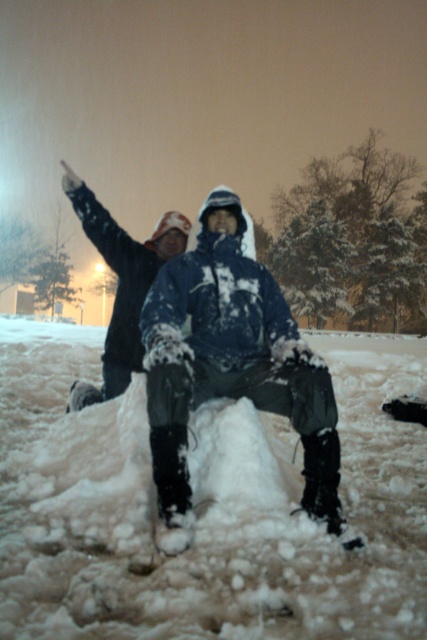
Question: Which of these objects is positioned closest to the dark blue jacket at center?

Choices:
 (A) snow-covered jacket at center
 (B) white fluffy snow at center

Answer: (A)

Question: Among these objects, which one is farthest from the camera?

Choices:
 (A) white fluffy snow at center
 (B) snow-covered jacket at center
 (C) dark blue jacket at center

Answer: (C)

Question: Can you confirm if snow-covered jacket at center is thinner than dark blue jacket at center?

Choices:
 (A) no
 (B) yes

Answer: (B)

Question: Is white fluffy snow at center positioned behind snow-covered jacket at center?

Choices:
 (A) no
 (B) yes

Answer: (A)

Question: Is snow-covered jacket at center positioned in front of dark blue jacket at center?

Choices:
 (A) no
 (B) yes

Answer: (B)

Question: Which object is closer to the camera taking this photo?

Choices:
 (A) white fluffy snow at center
 (B) dark blue jacket at center
 (C) snow-covered jacket at center

Answer: (A)